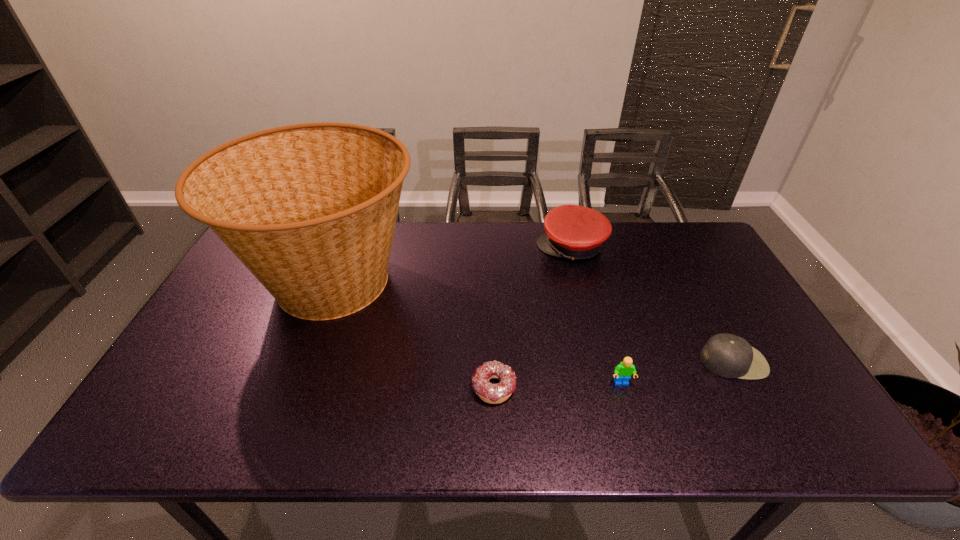
I want to click on free point between the Lego and the rightmost object, so click(x=677, y=373).

The height and width of the screenshot is (540, 960). Find the location of `free space that is in between the rightmost object and the third tallest object`. free space that is in between the rightmost object and the third tallest object is located at coordinates coord(677,373).

Identify the location of free spot between the farther cap and the Lego. (596, 315).

Image resolution: width=960 pixels, height=540 pixels. Find the location of `free space between the second shortest object and the leftmost object`. free space between the second shortest object and the leftmost object is located at coordinates [533, 322].

Locate an element on the screen. This screenshot has width=960, height=540. unoccupied position between the third shortest object and the shortest object is located at coordinates (558, 385).

Find the location of a particular element. Image resolution: width=960 pixels, height=540 pixels. blank region between the leftmost object and the second object from left to right is located at coordinates (413, 335).

Locate which object is the fourth closest to the third shortest object. Please provide its 2D coordinates. Your answer should be formatted as a tuple, i.e. [(x, y)], where the tuple contains the x and y coordinates of a point satisfying the conditions above.

[(310, 209)]

This screenshot has height=540, width=960. I want to click on the closest object to the Lego, so click(x=729, y=356).